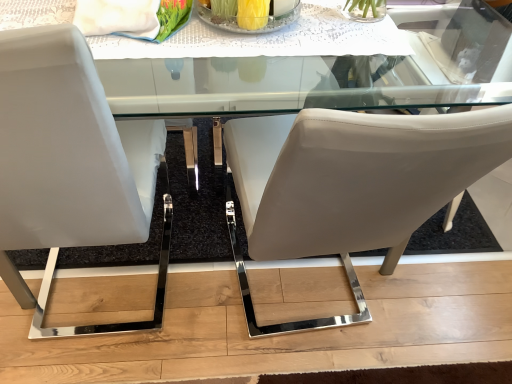
Question: Is clear glass table at upper center in contact with white leather chair at left, placed as the 2th chair when sorted from right to left?

Choices:
 (A) no
 (B) yes

Answer: (A)

Question: Is clear glass table at upper center in front of white leather chair at left, the first chair when ordered from left to right?

Choices:
 (A) yes
 (B) no

Answer: (B)

Question: Are clear glass table at upper center and white leather chair at left, placed as the 2th chair when sorted from right to left, located far from each other?

Choices:
 (A) no
 (B) yes

Answer: (A)

Question: Is clear glass table at upper center located outside white leather chair at left, the first chair when ordered from left to right?

Choices:
 (A) no
 (B) yes

Answer: (B)

Question: Is clear glass table at upper center bigger than white leather chair at left, placed as the 2th chair when sorted from right to left?

Choices:
 (A) yes
 (B) no

Answer: (B)

Question: From a real-world perspective, is matte white chair at center, placed as the second chair when sorted from left to right, positioned above or below clear glass table at upper center?

Choices:
 (A) below
 (B) above

Answer: (A)

Question: Would you say matte white chair at center, positioned as the first chair in right-to-left order, is to the left or to the right of clear glass table at upper center in the picture?

Choices:
 (A) left
 (B) right

Answer: (B)

Question: Considering the positions of matte white chair at center, positioned as the first chair in right-to-left order, and clear glass table at upper center in the image, is matte white chair at center, positioned as the first chair in right-to-left order, taller or shorter than clear glass table at upper center?

Choices:
 (A) tall
 (B) short

Answer: (A)

Question: Is matte white chair at center, positioned as the first chair in right-to-left order, inside the boundaries of clear glass table at upper center, or outside?

Choices:
 (A) inside
 (B) outside

Answer: (B)

Question: Considering the positions of clear glass bowl at center and white leather chair at left, placed as the 2th chair when sorted from right to left, in the image, is clear glass bowl at center bigger or smaller than white leather chair at left, placed as the 2th chair when sorted from right to left,?

Choices:
 (A) small
 (B) big

Answer: (A)

Question: From a real-world perspective, relative to white leather chair at left, placed as the 2th chair when sorted from right to left, is clear glass bowl at center vertically above or below?

Choices:
 (A) below
 (B) above

Answer: (B)

Question: From the image's perspective, is clear glass bowl at center located above or below white leather chair at left, the first chair when ordered from left to right?

Choices:
 (A) above
 (B) below

Answer: (A)

Question: Considering their positions, is clear glass bowl at center located in front of or behind white leather chair at left, the first chair when ordered from left to right?

Choices:
 (A) front
 (B) behind

Answer: (B)

Question: Is clear glass table at upper center to the left or to the right of clear glass bowl at center in the image?

Choices:
 (A) right
 (B) left

Answer: (B)

Question: Is clear glass table at upper center in front of or behind clear glass bowl at center in the image?

Choices:
 (A) behind
 (B) front

Answer: (B)